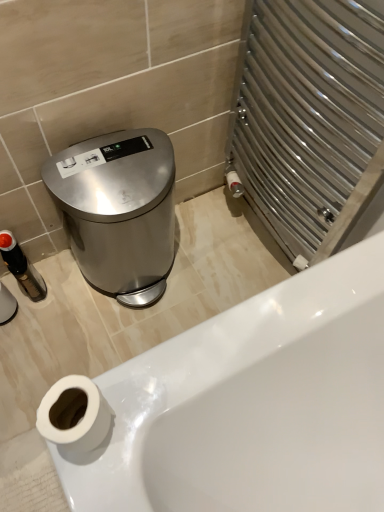
The image size is (384, 512). Identify the location of empty space that is ontop of polished stainless steel trash can at left (from a real-world perspective). (109, 165).